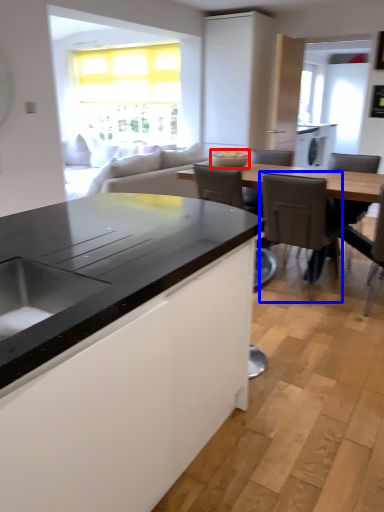
Question: Which object appears farthest to the camera in this image, appliance (highlighted by a red box) or chair (highlighted by a blue box)?

Choices:
 (A) appliance
 (B) chair

Answer: (A)